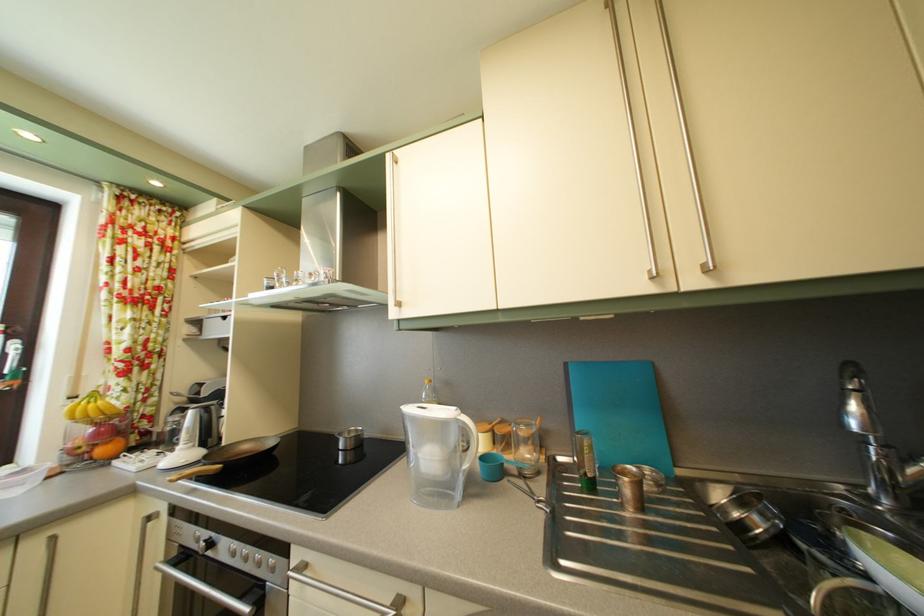
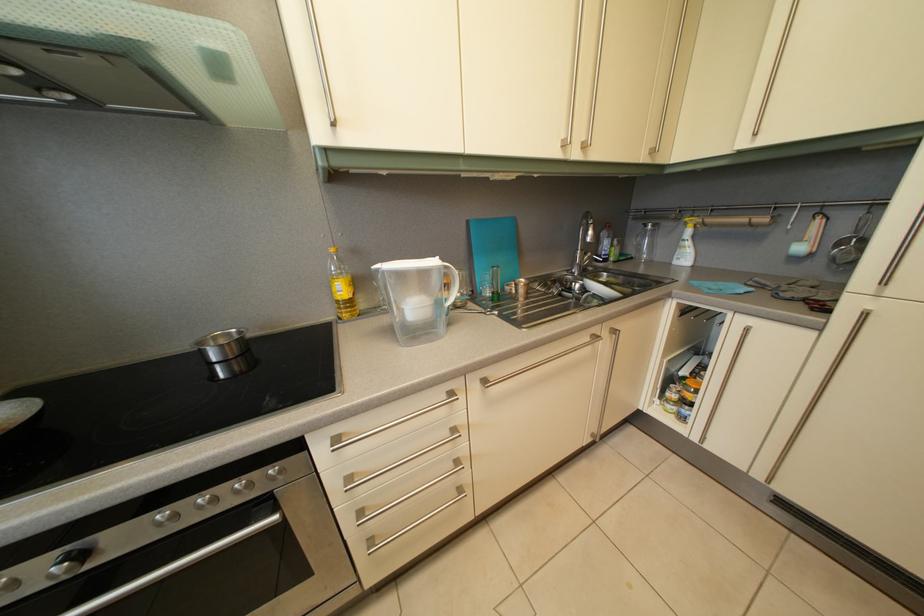
In the second image, find the point that corresponds to pixel 358 439 in the first image.

(224, 346)